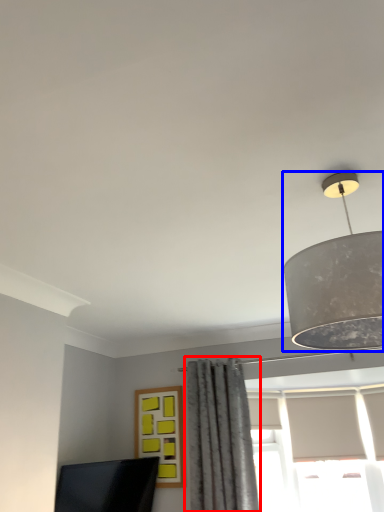
Question: Which object appears farthest to the camera in this image, curtain (highlighted by a red box) or lamp (highlighted by a blue box)?

Choices:
 (A) curtain
 (B) lamp

Answer: (A)